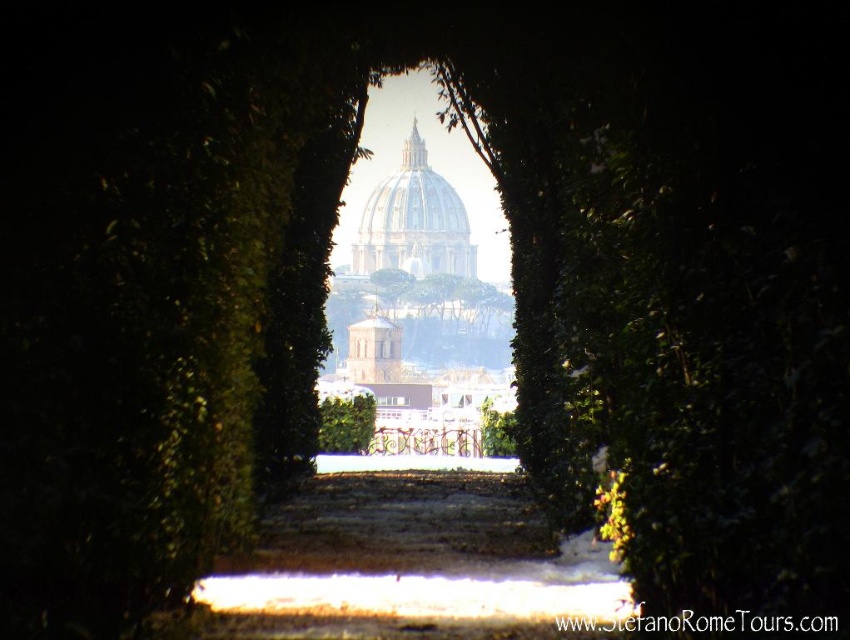
Identify the location of green leafy hedge at center. (344, 419).

Does point (333, 396) come closer to viewer compared to point (384, 289)?

That is True.

The height and width of the screenshot is (640, 850). Describe the element at coordinates (344, 419) in the screenshot. I see `green leafy hedge at center` at that location.

You are a GUI agent. You are given a task and a screenshot of the screen. Output one action in this format:
    pyautogui.click(x=<x>, y=<y>)
    Task: Click on the green leafy hedge at center
    The height and width of the screenshot is (640, 850).
    Given the screenshot: What is the action you would take?
    pyautogui.click(x=344, y=419)

Which of these two, white marble dome at center or green leafy tree at center, stands taller?

Standing taller between the two is white marble dome at center.

Between white marble dome at center and green leafy tree at center, which one appears on the left side from the viewer's perspective?

green leafy tree at center

Identify the location of white marble dome at center. (412, 204).

From the picture: Who is higher up, white marble dome at center or green leafy hedge at center?

Positioned higher is white marble dome at center.

Measure the distance between white marble dome at center and camera.

white marble dome at center is 1369.36 feet from camera.

Locate an element on the screen. The height and width of the screenshot is (640, 850). white marble dome at center is located at coordinates (412, 204).

This screenshot has height=640, width=850. In order to click on white marble dome at center in this screenshot , I will do `click(412, 204)`.